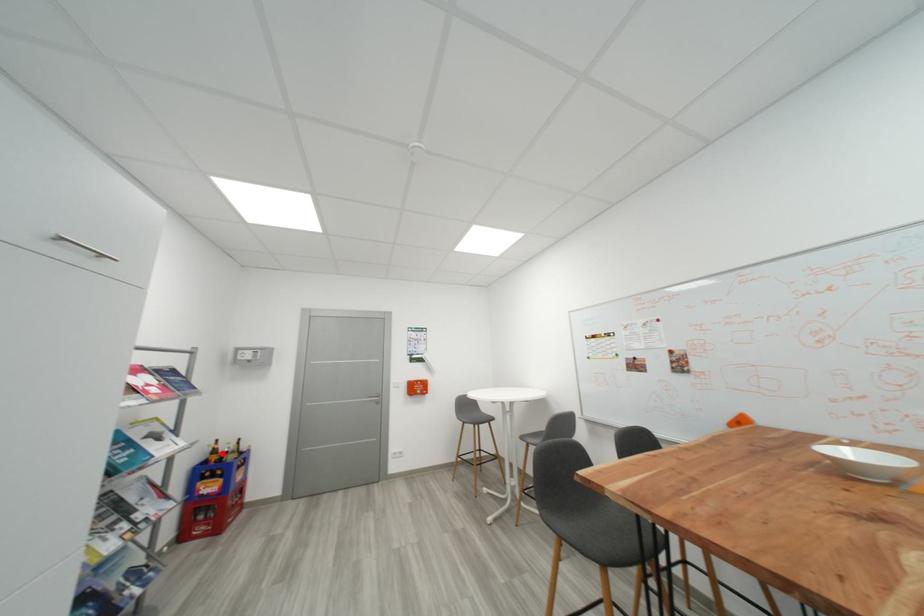
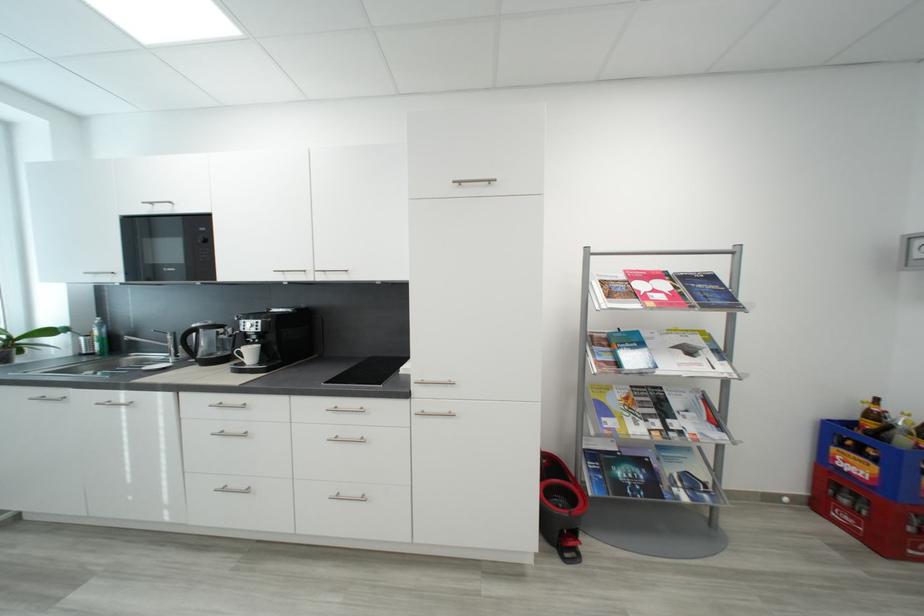
In the second image, find the point that corresponds to the highlighted location in the first image.

(881, 418)